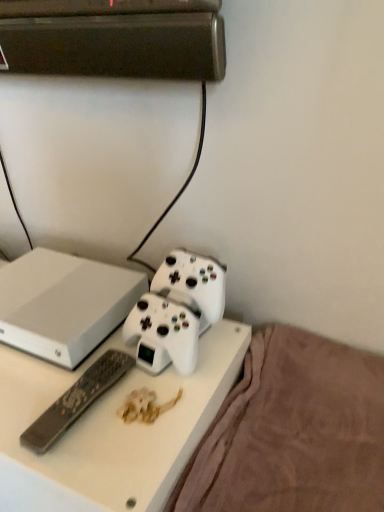
Question: Is brown plush blanket at lower right closer to the viewer compared to black plastic remote at lower left?

Choices:
 (A) yes
 (B) no

Answer: (A)

Question: From a real-world perspective, is brown plush blanket at lower right positioned over black plastic remote at lower left based on gravity?

Choices:
 (A) yes
 (B) no

Answer: (B)

Question: Considering the relative sizes of brown plush blanket at lower right and black plastic remote at lower left in the image provided, is brown plush blanket at lower right taller than black plastic remote at lower left?

Choices:
 (A) no
 (B) yes

Answer: (B)

Question: Can you confirm if brown plush blanket at lower right is wider than black plastic remote at lower left?

Choices:
 (A) no
 (B) yes

Answer: (B)

Question: Does brown plush blanket at lower right come behind black plastic remote at lower left?

Choices:
 (A) yes
 (B) no

Answer: (B)

Question: From the image's perspective, would you say brown plush blanket at lower right is shown under black plastic remote at lower left?

Choices:
 (A) yes
 (B) no

Answer: (A)

Question: Is black plastic remote at lower left turned away from white matte game controller at center?

Choices:
 (A) yes
 (B) no

Answer: (A)

Question: Would you say black plastic remote at lower left is outside white matte game controller at center?

Choices:
 (A) yes
 (B) no

Answer: (A)

Question: Is black plastic remote at lower left placed right next to white matte game controller at center?

Choices:
 (A) yes
 (B) no

Answer: (B)

Question: From the image's perspective, is black plastic remote at lower left above white matte game controller at center?

Choices:
 (A) yes
 (B) no

Answer: (B)

Question: Does black plastic remote at lower left turn towards white matte game controller at center?

Choices:
 (A) no
 (B) yes

Answer: (A)

Question: Considering the relative sizes of black plastic remote at lower left and white matte game controller at center in the image provided, is black plastic remote at lower left smaller than white matte game controller at center?

Choices:
 (A) no
 (B) yes

Answer: (B)

Question: Does white plastic desk at center lie behind black plastic remote at lower left?

Choices:
 (A) no
 (B) yes

Answer: (A)